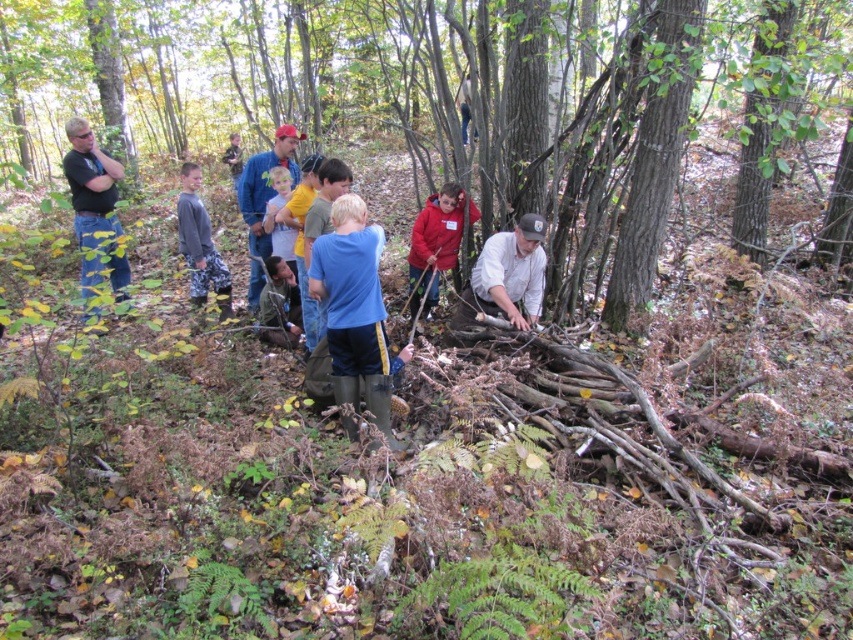
Question: Is gray camouflage pants at left above blue shirt at center?

Choices:
 (A) yes
 (B) no

Answer: (B)

Question: Which object appears farthest from the camera in this image?

Choices:
 (A) gray camouflage pants at left
 (B) black shirt at left
 (C) camouflage shirt at center

Answer: (C)

Question: Which point appears farthest from the camera in this image?

Choices:
 (A) (445, 250)
 (B) (523, 253)
 (C) (345, 387)

Answer: (A)

Question: Is black shirt at left smaller than camouflage shirt at center?

Choices:
 (A) yes
 (B) no

Answer: (B)

Question: Is brown rough tree trunk at center behind blue shirt at center?

Choices:
 (A) yes
 (B) no

Answer: (B)

Question: Among these objects, which one is nearest to the camera?

Choices:
 (A) camouflage shirt at center
 (B) white cotton shirt at center
 (C) black shirt at left

Answer: (B)